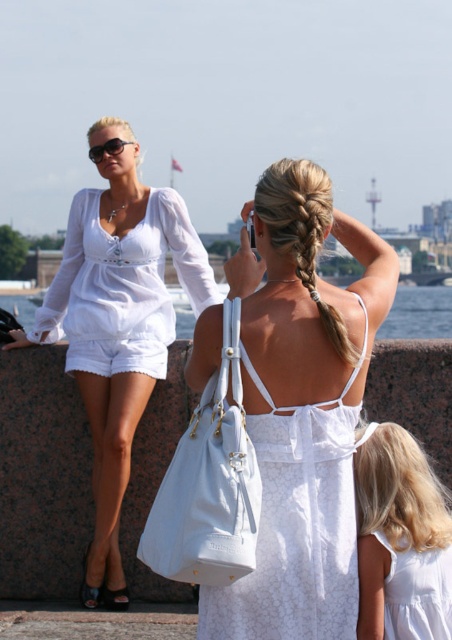
Question: Which object is farther from the camera taking this photo?

Choices:
 (A) white fabric dress at center
 (B) white lace dress at center

Answer: (A)

Question: Is the position of white fabric dress at center more distant than that of golden hair braid at upper center?

Choices:
 (A) no
 (B) yes

Answer: (A)

Question: Which object is positioned closest to the matte white blouse at center?

Choices:
 (A) clear water at center
 (B) white lace dress at center
 (C) white fabric dress at center
 (D) golden hair braid at upper center

Answer: (C)

Question: Estimate the real-world distances between objects in this image. Which object is closer to the clear water at center?

Choices:
 (A) white lace dress at center
 (B) matte white blouse at center

Answer: (A)

Question: Does white fabric dress at center appear under golden hair braid at upper center?

Choices:
 (A) yes
 (B) no

Answer: (A)

Question: Does white lace dress at lower right have a greater width compared to clear water at center?

Choices:
 (A) no
 (B) yes

Answer: (A)